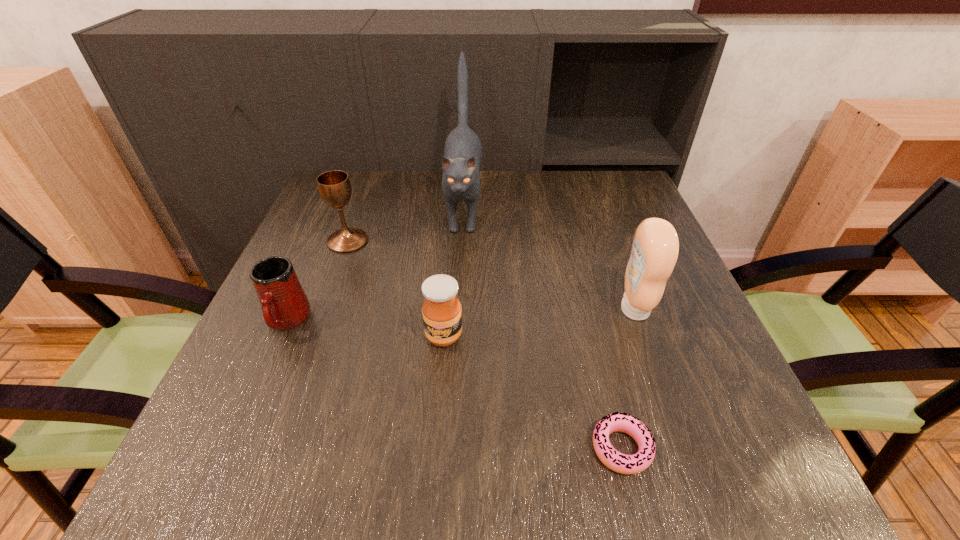
What are the coordinates of `cat` in the screenshot? It's located at (462, 157).

Identify the location of the fifth shortest object. This screenshot has height=540, width=960. (655, 248).

Identify the location of the rightmost object. (655, 248).

Find the location of `the third tallest object`. the third tallest object is located at coordinates (334, 186).

Identify the location of honey. The width and height of the screenshot is (960, 540). (442, 316).

At what (x,y) coordinates should I click in order to perform the action: click on mug. Please return your answer as a coordinate pair (x, y). Looking at the image, I should click on (284, 304).

Locate an element on the screen. the nearest object is located at coordinates (621, 463).

Identify the location of doughnut. (621, 463).

Locate an element on the screen. The height and width of the screenshot is (540, 960). free space located at the face of the cat is located at coordinates (454, 392).

The image size is (960, 540). Identify the location of vacant space located on the label of the condiment. (560, 309).